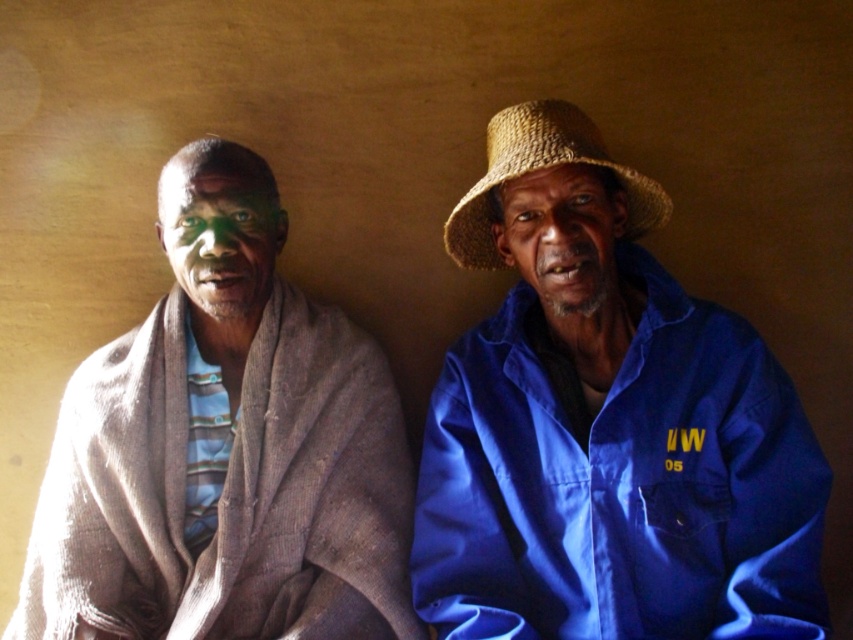
Question: Estimate the real-world distances between objects in this image. Which object is farther from the blue fabric shirt at right?

Choices:
 (A) matte gray scarf at left
 (B) brown straw hat at upper right
 (C) strawmaterial/texturehat at right

Answer: (A)

Question: Which object appears closest to the camera in this image?

Choices:
 (A) matte gray scarf at left
 (B) brown straw hat at upper right
 (C) brown textured blanket at left

Answer: (B)

Question: Which of these objects is positioned closest to the brown straw hat at upper right?

Choices:
 (A) strawmaterial/texturehat at right
 (B) brown textured blanket at left

Answer: (A)

Question: Does brown textured blanket at left appear over strawmaterial/texturehat at right?

Choices:
 (A) yes
 (B) no

Answer: (B)

Question: Can you confirm if blue fabric shirt at right is positioned to the right of matte gray scarf at left?

Choices:
 (A) no
 (B) yes

Answer: (B)

Question: Is matte gray scarf at left positioned behind brown straw hat at upper right?

Choices:
 (A) no
 (B) yes

Answer: (B)